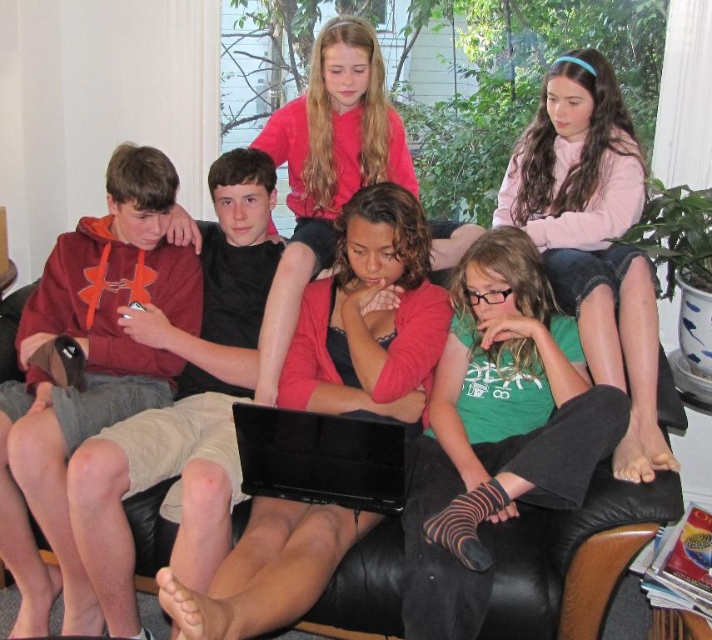
You are a delivery person trying to place a small package between the matte pink sweater at center and the black glossy laptop at center on the couch. Can you fit the package there?

The matte pink sweater at center is taller than the black glossy laptop at center, so there might be enough space between them to place the small package.

You are a photographer standing at the origin point of the coordinate system in the living room. You want to take a photo of the children on the couch. Which point should you stand closer to, point A at (313, 355) or point B at (372, 173), to ensure the children are fully visible in the frame?

You should stand closer to point B at (372, 173) because point A at (313, 355) is in front of point B. Being closer to point B allows you to capture the entire group without obstruction from the foreground object at point A.

You are a parent trying to retrieve your child who is sitting on the black leather couch. You see the matte black laptop at center and the black glossy laptop at center. Which laptop is positioned higher up?

The matte black laptop at center is located above the black glossy laptop at center, so it is positioned higher up.